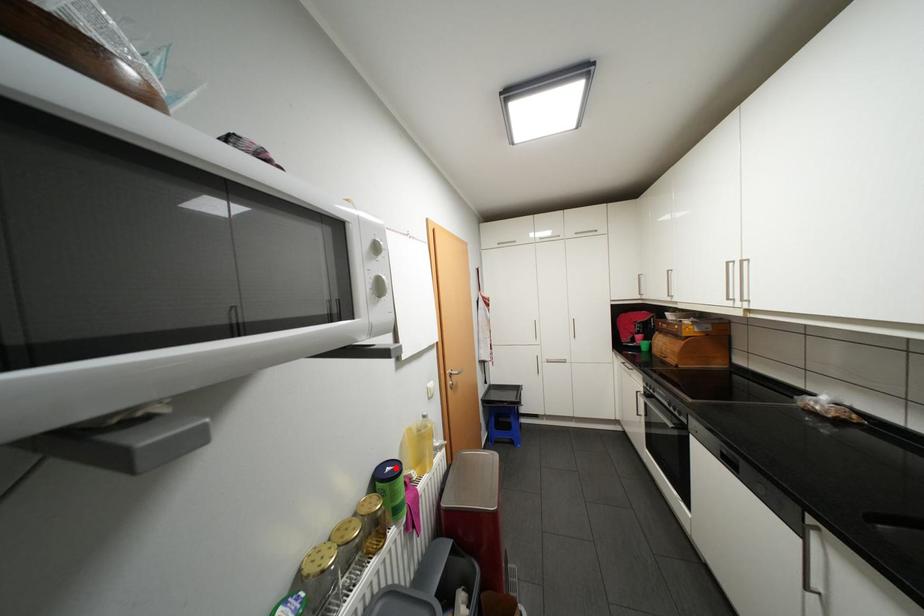
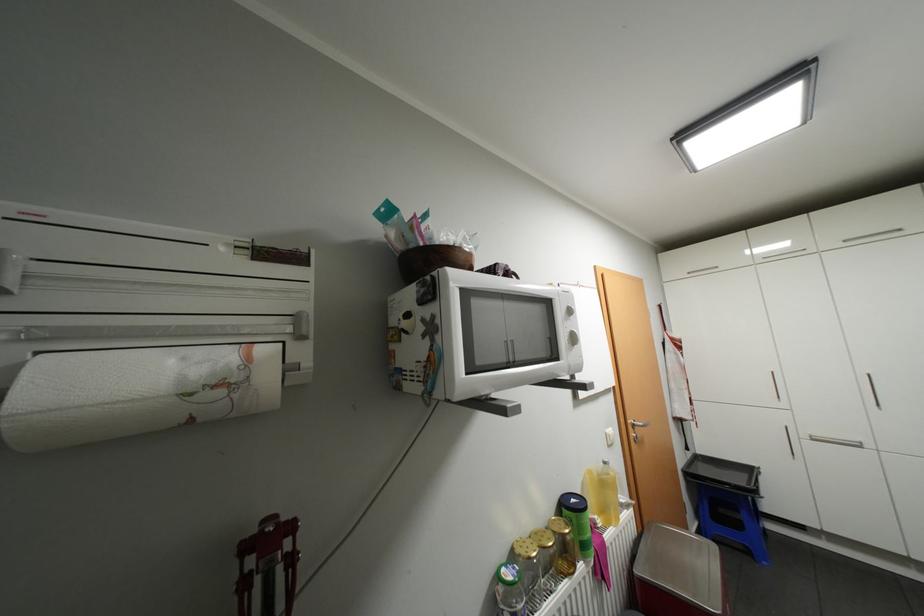
In the second image, find the point that corresponds to the highlighted location in the first image.

(580, 499)